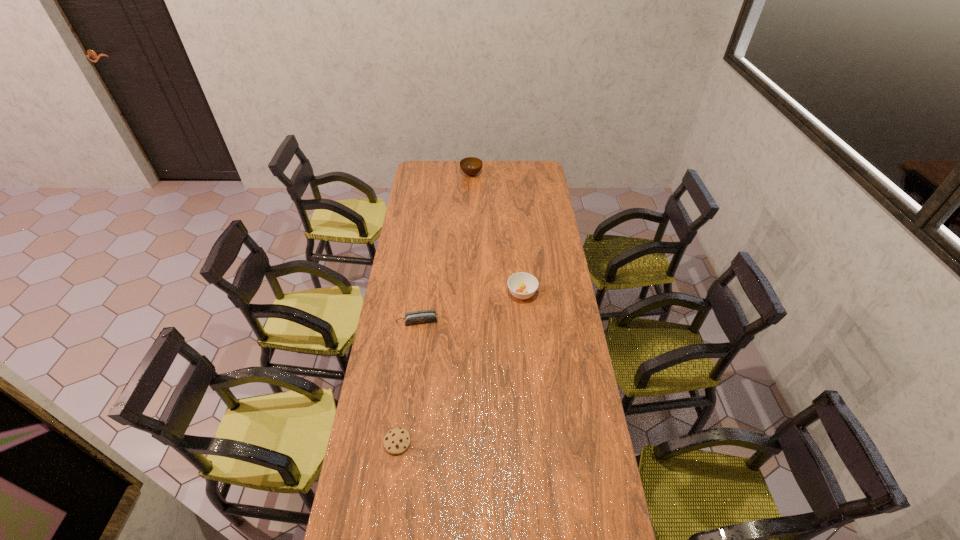
I want to click on vacant space located 0.100m on the front of the third farthest object, so click(x=415, y=345).

Find the location of `blank space located 0.220m on the right of the nearest object`. blank space located 0.220m on the right of the nearest object is located at coordinates (471, 442).

Image resolution: width=960 pixels, height=540 pixels. Identify the location of object that is at the far edge. (471, 166).

At what (x,y) coordinates should I click in order to perform the action: click on pencil box situated at the left edge. Please return your answer as a coordinate pair (x, y). The width and height of the screenshot is (960, 540). Looking at the image, I should click on (424, 316).

Find the location of a particular element. Image resolution: width=960 pixels, height=540 pixels. cookie positioned at the left edge is located at coordinates (396, 441).

Image resolution: width=960 pixels, height=540 pixels. I want to click on object that is positioned at the right edge, so click(x=522, y=285).

Locate an element on the screen. This screenshot has height=540, width=960. vacant space at the far edge of the desktop is located at coordinates (497, 174).

At what (x,y) coordinates should I click in order to perform the action: click on vacant space at the left edge of the desktop. Please return your answer as a coordinate pair (x, y). Looking at the image, I should click on (416, 181).

Locate an element on the screen. free space at the right edge of the desktop is located at coordinates (564, 272).

Image resolution: width=960 pixels, height=540 pixels. I want to click on vacant space that's between the soup bowl and the cookie, so click(x=460, y=368).